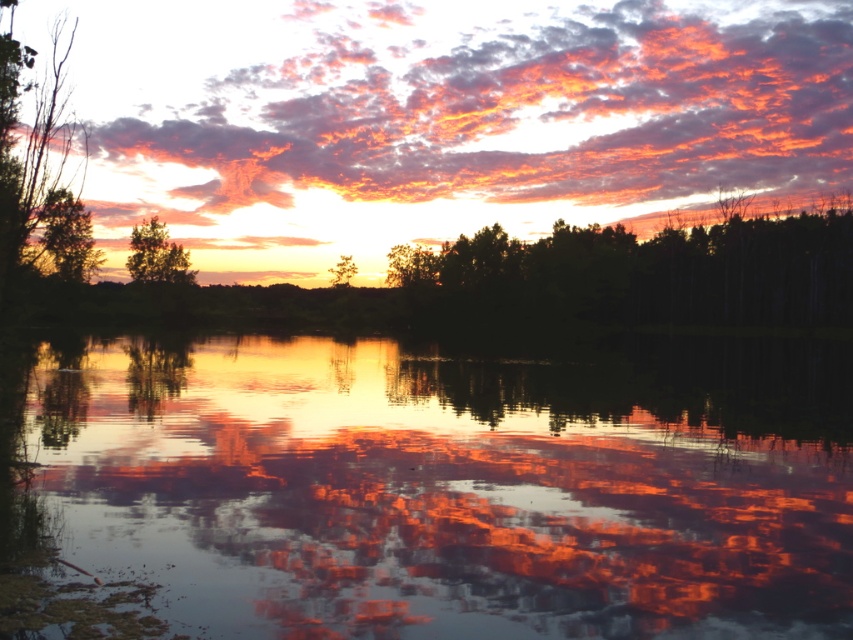
Can you confirm if glossy reflective water at center is taller than silhouette/black trees at center?

No.

Who is more forward, (286,465) or (850,284)?

Point (286,465)

Between point (616, 385) and point (700, 289), which one is positioned in front?

Point (616, 385) is in front.

At what (x,y) coordinates should I click in order to perform the action: click on glossy reflective water at center. Please return your answer as a coordinate pair (x, y). Looking at the image, I should click on (456, 483).

Is silhouette bark tree at left thinner than green matte tree at left?

In fact, silhouette bark tree at left might be wider than green matte tree at left.

Measure the distance between point (x=18, y=67) and camera.

The distance of point (x=18, y=67) from camera is 25.02 meters.

Between point (16, 112) and point (51, 192), which one is positioned in front?

Point (16, 112) is in front.

The image size is (853, 640). I want to click on silhouette bark tree at left, so click(x=39, y=164).

Does point (840, 172) come in front of point (62, 134)?

No, (840, 172) is further to viewer.

Between cloudy sky at upper center and silhouette bark tree at left, which one is positioned lower?

silhouette bark tree at left

Measure the distance between point (387, 131) and camera.

Point (387, 131) and camera are 188.40 meters apart from each other.

Locate an element on the screen. This screenshot has width=853, height=640. cloudy sky at upper center is located at coordinates (460, 100).